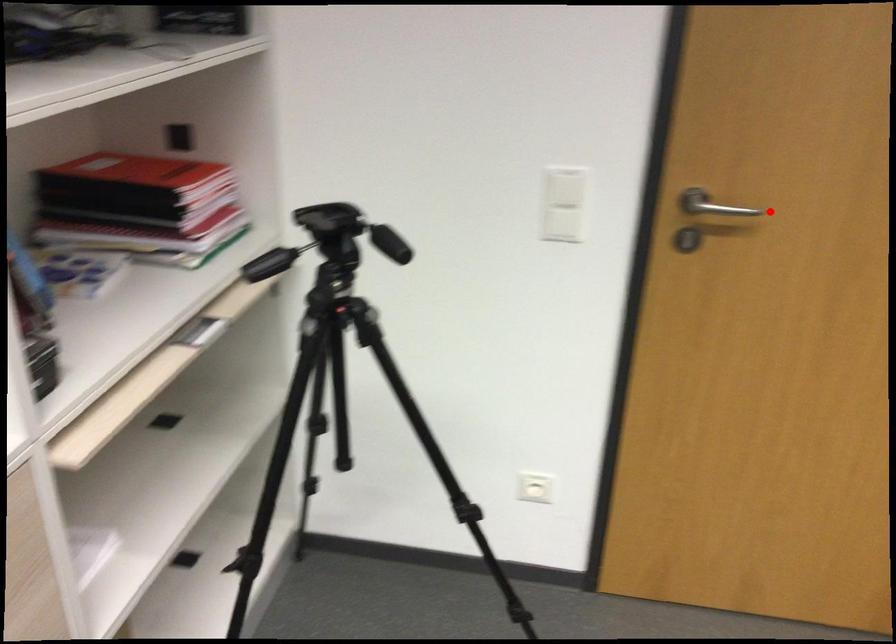
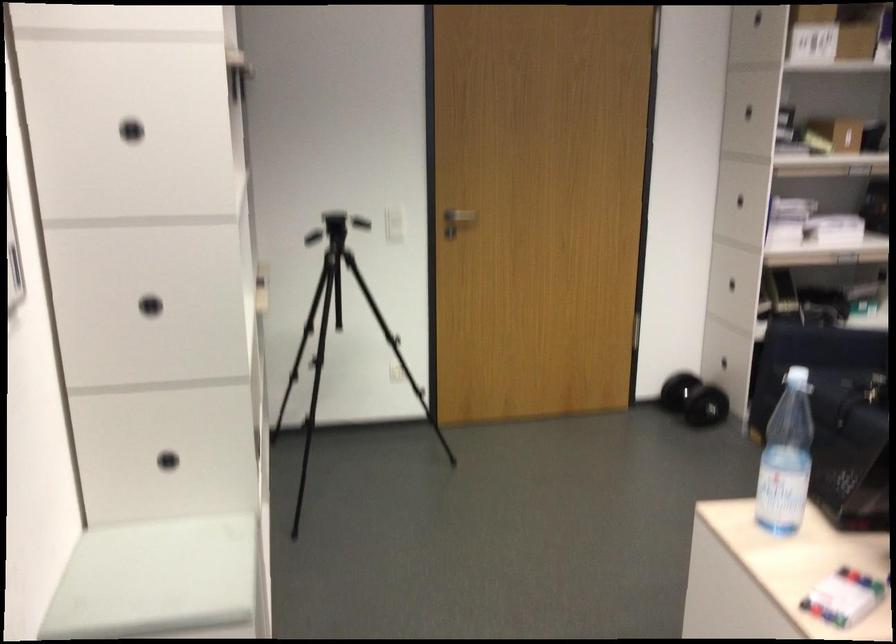
Where in the second image is the point corresponding to the highlighted location from the first image?

(460, 216)